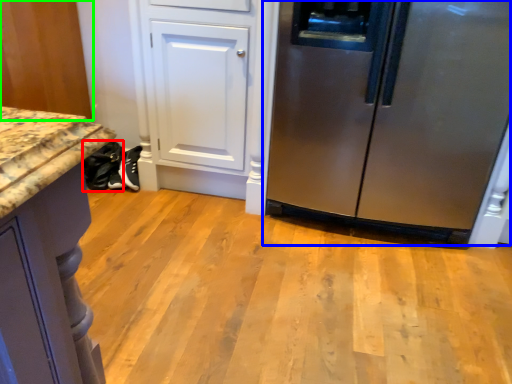
Question: Estimate the real-world distances between objects in this image. Which object is closer to footwear (highlighted by a red box), refrigerator (highlighted by a blue box) or cabinetry (highlighted by a green box)?

Choices:
 (A) refrigerator
 (B) cabinetry

Answer: (B)